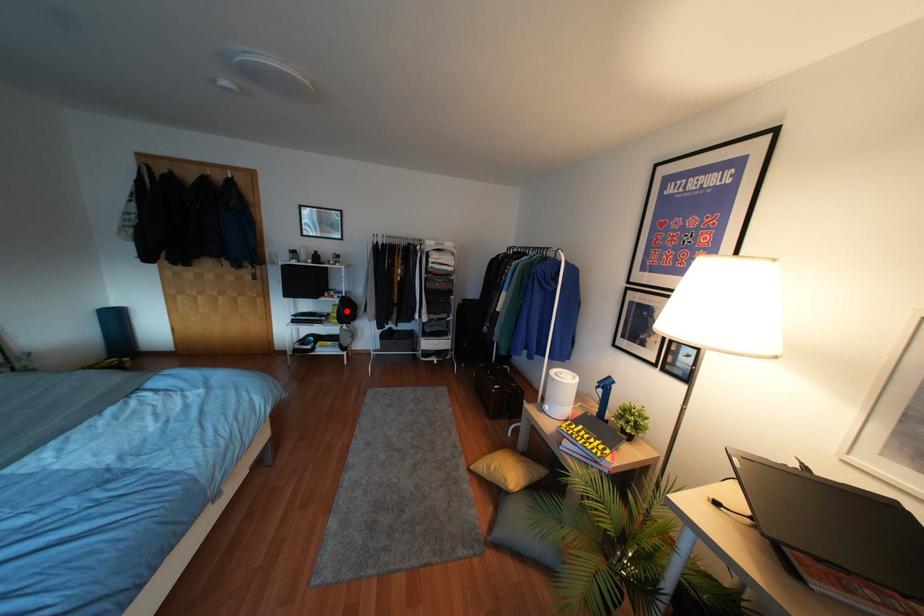
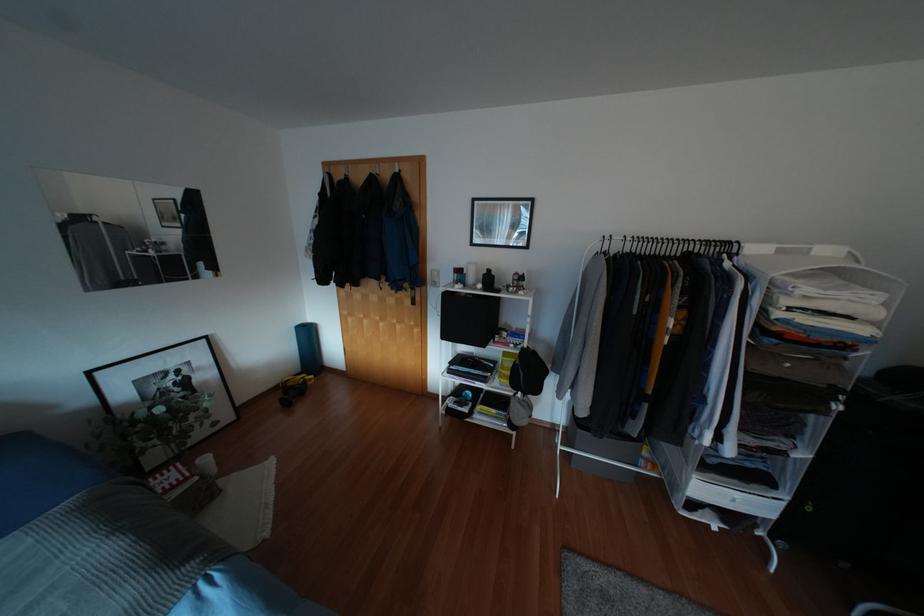
Find the pixel in the second image that matches the highlighted location in the first image.

(528, 371)